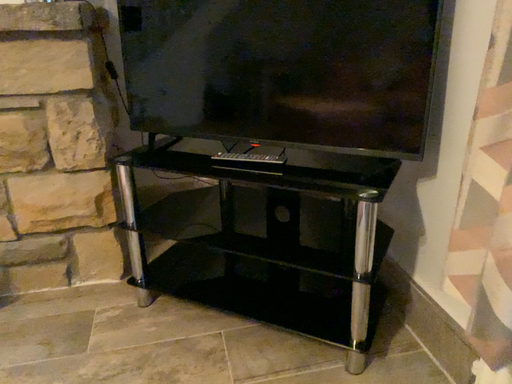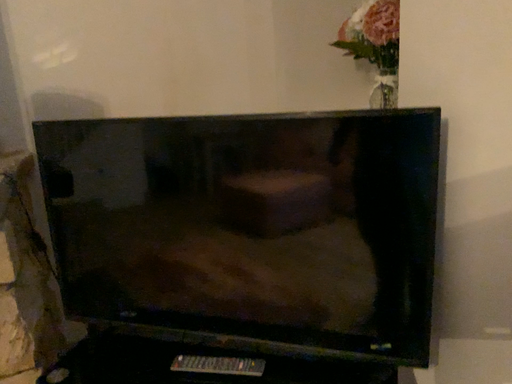
Question: Which way did the camera rotate in the video?

Choices:
 (A) rotated left
 (B) rotated right

Answer: (B)